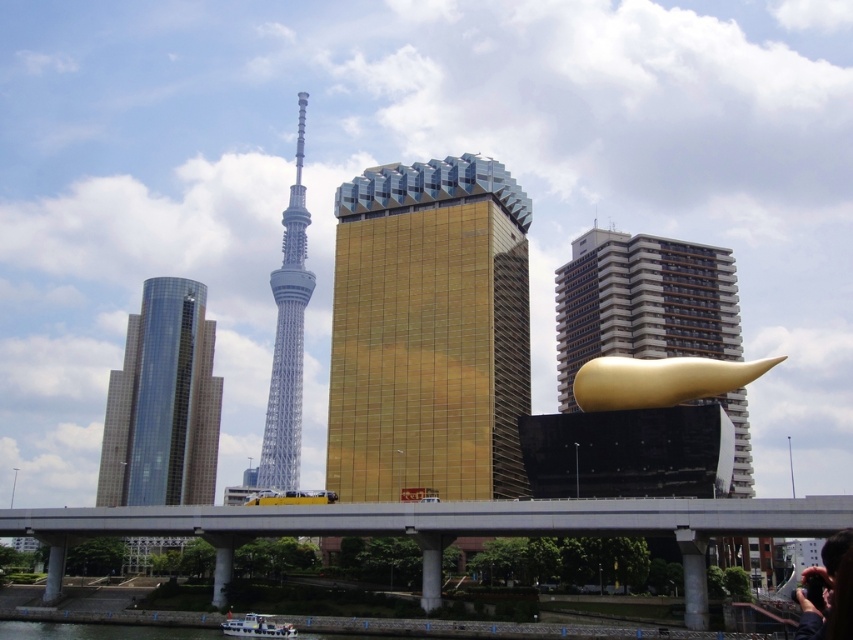
Question: Which object appears farthest from the camera in this image?

Choices:
 (A) concrete bridge at center
 (B) gold reflective sculpture at center-right
 (C) silver metallic tower at center

Answer: (C)

Question: Which of the following is the closest to the observer?

Choices:
 (A) (186, 392)
 (B) (431, 524)
 (C) (462, 186)

Answer: (B)

Question: Which of the following is the farthest from the observer?

Choices:
 (A) (276, 429)
 (B) (265, 616)
 (C) (254, 525)
 (D) (149, 332)

Answer: (A)

Question: Does gold reflective sculpture at center-right appear under white plastic boat at lower left?

Choices:
 (A) yes
 (B) no

Answer: (B)

Question: Does gold reflective sculpture at center-right appear over white plastic boat at lower left?

Choices:
 (A) no
 (B) yes

Answer: (B)

Question: Does concrete bridge at center have a larger size compared to silver metallic tower at center?

Choices:
 (A) no
 (B) yes

Answer: (A)